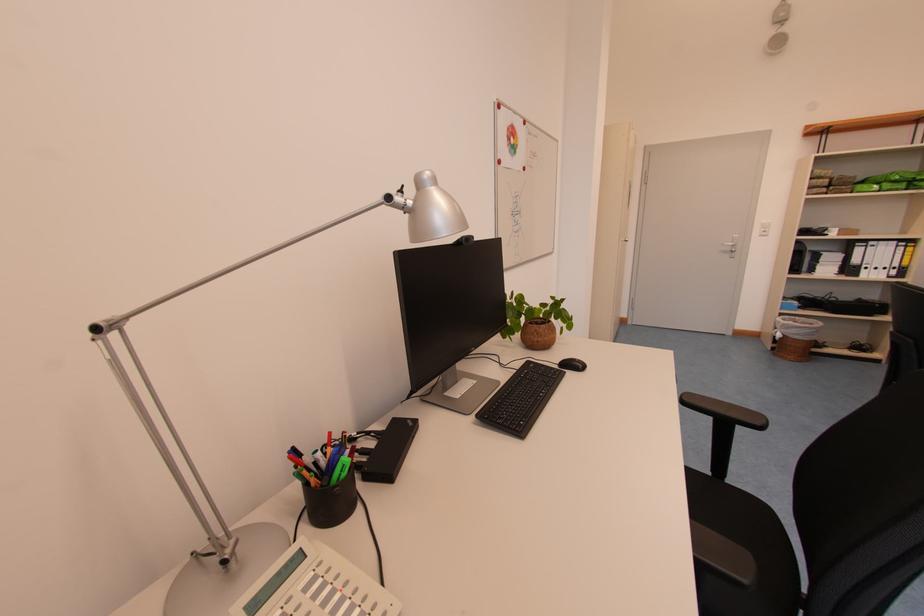
The location [572,363] corresponds to which object?

It corresponds to the black computer mouse in the image.